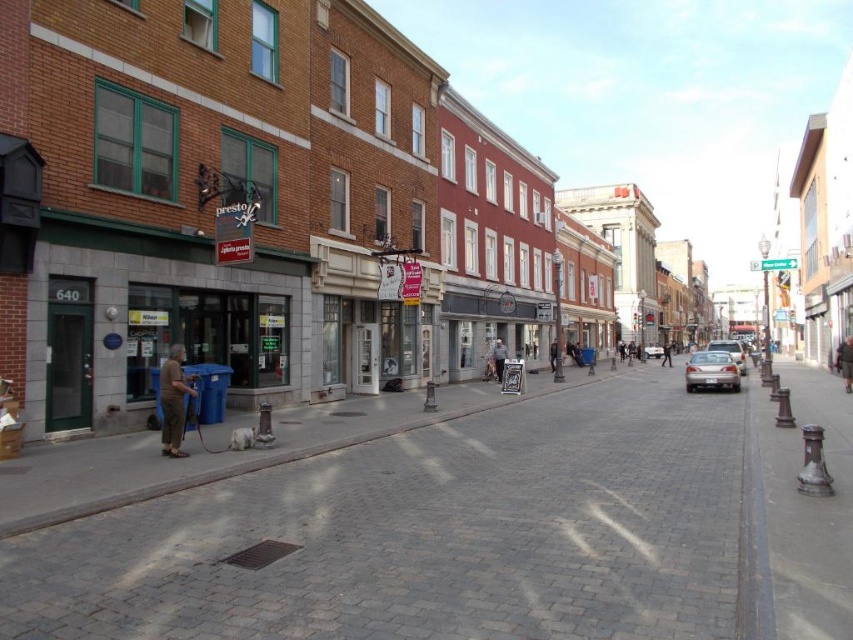
Question: Is brown cotton shirt at lower left wider than gray fabric jacket at center?

Choices:
 (A) yes
 (B) no

Answer: (A)

Question: Which object is closer to the camera taking this photo?

Choices:
 (A) brown cotton shirt at lower left
 (B) gray fabric jacket at center
 (C) dark blue jeans at center
 (D) silver metallic sedan at center-right

Answer: (A)

Question: Among these objects, which one is nearest to the camera?

Choices:
 (A) brown leather jacket at center
 (B) silver metallic sedan at center
 (C) silver metallic sedan at right
 (D) dark blue jeans at center

Answer: (A)

Question: Estimate the real-world distances between objects in this image. Which object is farther from the gray cobblestone pavement at center?

Choices:
 (A) gray fabric jacket at center
 (B) dark gray leather jacket at center
 (C) silver metallic sedan at center

Answer: (C)

Question: Does gray fabric jacket at center appear under dark blue jeans at center?

Choices:
 (A) no
 (B) yes

Answer: (A)

Question: Can you confirm if gray cobblestone pavement at center is wider than brown cotton shirt at lower left?

Choices:
 (A) yes
 (B) no

Answer: (A)